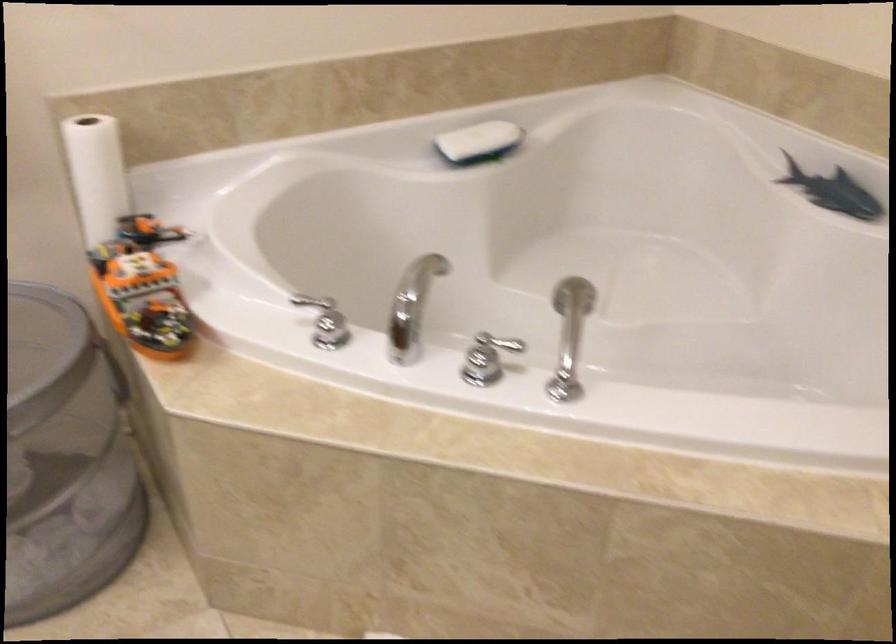
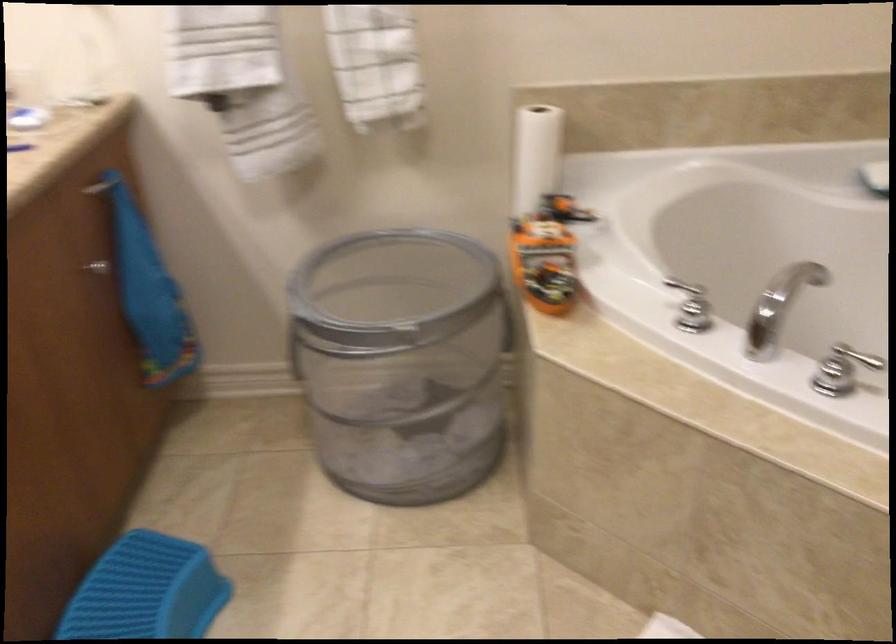
Find the pixel in the second image that matches (x=151, y=292) in the first image.

(547, 252)